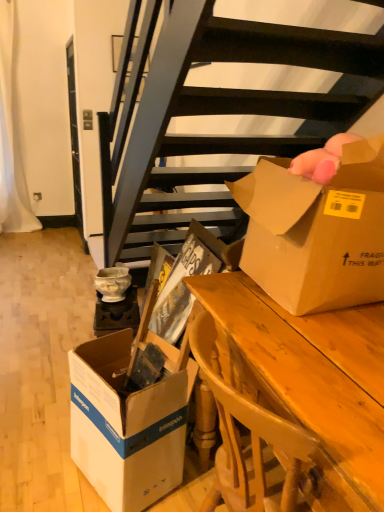
What is the approximate height of white cardboard box at lower left, positioned as the 2th box in top-to-bottom order?

The height of white cardboard box at lower left, positioned as the 2th box in top-to-bottom order, is 55.92 centimeters.

What do you see at coordinates (126, 425) in the screenshot?
I see `white cardboard box at lower left, which is the 2th box in right-to-left order` at bounding box center [126, 425].

Locate an element on the screen. brown cardboard box at upper right, positioned as the 1th box in right-to-left order is located at coordinates (316, 231).

You are a GUI agent. You are given a task and a screenshot of the screen. Output one action in this format:
    pyautogui.click(x=<x>, y=<y>)
    Task: Click on the cardboard box at center
    This screenshot has width=384, height=512.
    Given the screenshot: What is the action you would take?
    pyautogui.click(x=130, y=416)

Considering the sizes of wooden desk at center and cardboard box at center in the image, is wooden desk at center taller or shorter than cardboard box at center?

Clearly, wooden desk at center is shorter compared to cardboard box at center.

Is wooden desk at center in front of cardboard box at center?

Yes, it is in front of cardboard box at center.

Can you confirm if wooden desk at center is positioned to the right of cardboard box at center?

Indeed, wooden desk at center is positioned on the right side of cardboard box at center.

Is wooden desk at center directly adjacent to cardboard box at center?

No, wooden desk at center is not with cardboard box at center.

Who is taller, cardboard box at center or white cardboard box at lower left, which is the 2th box in right-to-left order?

cardboard box at center is taller.

Does cardboard box at center have a lesser width compared to white cardboard box at lower left, which is the 2th box in right-to-left order?

No, cardboard box at center is not thinner than white cardboard box at lower left, which is the 2th box in right-to-left order.

From the image's perspective, is cardboard box at center under white cardboard box at lower left, which is the 2th box in right-to-left order?

No, from the image's perspective, cardboard box at center is not beneath white cardboard box at lower left, which is the 2th box in right-to-left order.

The height and width of the screenshot is (512, 384). I want to click on the 1st box in front of the cardboard box at center, counting from the anchor's position, so click(126, 425).

Considering the relative sizes of white cardboard box at lower left, positioned as the 1th box in bottom-to-top order, and brown cardboard box at upper right, the 2th box from the bottom, in the image provided, is white cardboard box at lower left, positioned as the 1th box in bottom-to-top order, wider than brown cardboard box at upper right, the 2th box from the bottom,?

Incorrect, the width of white cardboard box at lower left, positioned as the 1th box in bottom-to-top order, does not surpass that of brown cardboard box at upper right, the 2th box from the bottom.

From a real-world perspective, between white cardboard box at lower left, marked as the 1th box in a left-to-right arrangement, and brown cardboard box at upper right, the 1th box when ordered from top to bottom, who is vertically lower?

white cardboard box at lower left, marked as the 1th box in a left-to-right arrangement, is physically lower.

Can you tell me how much white cardboard box at lower left, positioned as the 2th box in top-to-bottom order, and brown cardboard box at upper right, the 1th box when ordered from top to bottom, differ in facing direction?

20.2 degrees.

Is white cardboard box at lower left, positioned as the 1th box in bottom-to-top order, facing away from brown cardboard box at upper right, the 1th box when ordered from top to bottom?

No, white cardboard box at lower left, positioned as the 1th box in bottom-to-top order, is not facing the opposite direction of brown cardboard box at upper right, the 1th box when ordered from top to bottom.

Is wooden desk at center far away from brown cardboard box at upper right, the 2th box from the bottom?

That's not correct — wooden desk at center is a little close to brown cardboard box at upper right, the 2th box from the bottom.

From the image's perspective, is wooden desk at center below brown cardboard box at upper right, the 2th box from the bottom?

Yes.

Can you tell me how much wooden desk at center and brown cardboard box at upper right, the 1th box when ordered from top to bottom, differ in facing direction?

The angle between the facing direction of wooden desk at center and the facing direction of brown cardboard box at upper right, the 1th box when ordered from top to bottom, is 0.659 degrees.

Can you confirm if wooden desk at center is wider than brown cardboard box at upper right, positioned as the 1th box in right-to-left order?

Correct, the width of wooden desk at center exceeds that of brown cardboard box at upper right, positioned as the 1th box in right-to-left order.

Is cardboard box at center not within wooden desk at center?

Absolutely, cardboard box at center is external to wooden desk at center.

Is cardboard box at center oriented away from wooden desk at center?

No, cardboard box at center is not facing the opposite direction of wooden desk at center.

Is cardboard box at center touching wooden desk at center?

No, cardboard box at center is not in contact with wooden desk at center.

Is point (129, 432) less distant than point (372, 416)?

No, it is not.

Where is `storage box that appears behind the brown cardboard box at upper right, the 1th box when ordered from top to bottom`? storage box that appears behind the brown cardboard box at upper right, the 1th box when ordered from top to bottom is located at coordinates (130, 416).

Is brown cardboard box at upper right, the 2th box from the bottom, bigger or smaller than cardboard box at center?

Considering their sizes, brown cardboard box at upper right, the 2th box from the bottom, takes up less space than cardboard box at center.

Is brown cardboard box at upper right, the second box in the left-to-right sequence, far from cardboard box at center?

That's not correct — brown cardboard box at upper right, the second box in the left-to-right sequence, is a little close to cardboard box at center.

In the scene shown: Can you confirm if brown cardboard box at upper right, positioned as the 1th box in right-to-left order, is positioned to the right of cardboard box at center?

Yes.

Locate an element on the screen. box on the left of cardboard box at center is located at coordinates (126, 425).

Relative to cardboard box at center, is white cardboard box at lower left, marked as the 1th box in a left-to-right arrangement, in front or behind?

In the image, white cardboard box at lower left, marked as the 1th box in a left-to-right arrangement, appears in front of cardboard box at center.

Considering the positions of points (180, 460) and (172, 442), is point (180, 460) closer to camera compared to point (172, 442)?

No, it is behind (172, 442).

Considering the sizes of objects white cardboard box at lower left, positioned as the 1th box in bottom-to-top order, and cardboard box at center in the image provided, who is thinner, white cardboard box at lower left, positioned as the 1th box in bottom-to-top order, or cardboard box at center?

With smaller width is white cardboard box at lower left, positioned as the 1th box in bottom-to-top order.

The width and height of the screenshot is (384, 512). I want to click on storage box located behind the wooden desk at center, so click(130, 416).

This screenshot has width=384, height=512. In the image, there is a cardboard box at center. In order to click on box below it (from a real-world perspective) in this screenshot , I will do `click(126, 425)`.

Estimate the real-world distances between objects in this image. Which object is further from brown cardboard box at upper right, the 1th box when ordered from top to bottom, cardboard box at center or wooden desk at center?

Based on the image, cardboard box at center appears to be further to brown cardboard box at upper right, the 1th box when ordered from top to bottom.

Looking at the image, which one is located further to wooden desk at center, white cardboard box at lower left, marked as the 1th box in a left-to-right arrangement, or cardboard box at center?

white cardboard box at lower left, marked as the 1th box in a left-to-right arrangement, lies further to wooden desk at center than the other object.

Based on their spatial positions, is white cardboard box at lower left, positioned as the 1th box in bottom-to-top order, or wooden desk at center further from cardboard box at center?

wooden desk at center.

Based on their spatial positions, is wooden desk at center or white cardboard box at lower left, positioned as the 2th box in top-to-bottom order, further from brown cardboard box at upper right, positioned as the 1th box in right-to-left order?

white cardboard box at lower left, positioned as the 2th box in top-to-bottom order, is positioned further to the anchor brown cardboard box at upper right, positioned as the 1th box in right-to-left order.

Looking at the image, which one is located closer to cardboard box at center, wooden desk at center or brown cardboard box at upper right, the 1th box when ordered from top to bottom?

wooden desk at center lies closer to cardboard box at center than the other object.

Looking at the image, which one is located further to white cardboard box at lower left, positioned as the 2th box in top-to-bottom order, wooden desk at center or brown cardboard box at upper right, the 2th box from the bottom?

brown cardboard box at upper right, the 2th box from the bottom, is positioned further to the anchor white cardboard box at lower left, positioned as the 2th box in top-to-bottom order.

Based on their spatial positions, is brown cardboard box at upper right, the second box in the left-to-right sequence, or wooden desk at center closer to white cardboard box at lower left, positioned as the 2th box in top-to-bottom order?

Among the two, wooden desk at center is located nearer to white cardboard box at lower left, positioned as the 2th box in top-to-bottom order.

Based on their spatial positions, is white cardboard box at lower left, positioned as the 1th box in bottom-to-top order, or brown cardboard box at upper right, positioned as the 1th box in right-to-left order, closer to cardboard box at center?

white cardboard box at lower left, positioned as the 1th box in bottom-to-top order, is closer to cardboard box at center.

Where is `storage box between brown cardboard box at upper right, the second box in the left-to-right sequence, and white cardboard box at lower left, positioned as the 2th box in top-to-bottom order, from top to bottom`? The width and height of the screenshot is (384, 512). storage box between brown cardboard box at upper right, the second box in the left-to-right sequence, and white cardboard box at lower left, positioned as the 2th box in top-to-bottom order, from top to bottom is located at coordinates (130, 416).

You are a GUI agent. You are given a task and a screenshot of the screen. Output one action in this format:
    pyautogui.click(x=<x>, y=<y>)
    Task: Click on the desk between brown cardboard box at upper right, the 1th box when ordered from top to bottom, and white cardboard box at lower left, positioned as the 1th box in bottom-to-top order, in the vertical direction
    The image size is (384, 512).
    Given the screenshot: What is the action you would take?
    pyautogui.click(x=302, y=378)